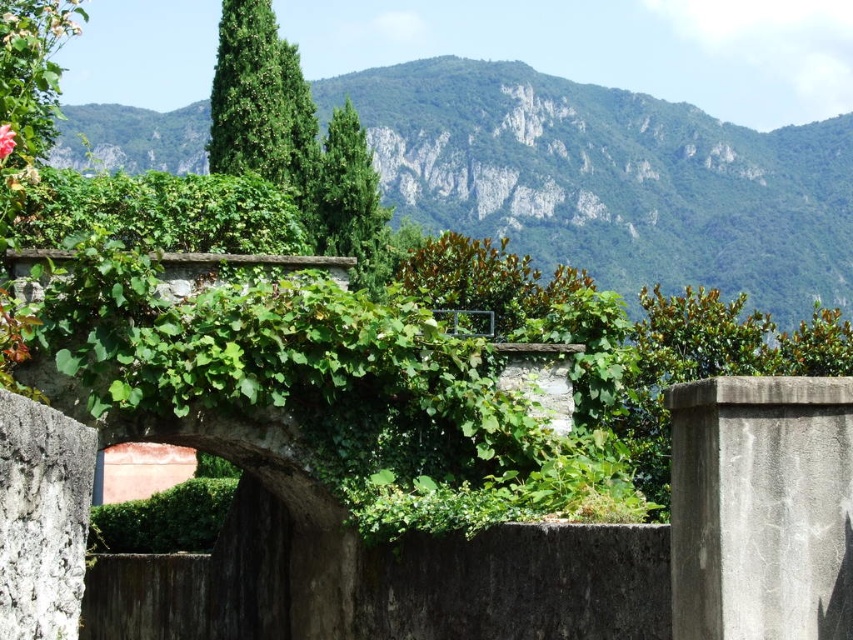
Is green leafy mountain at center to the right of green leafy plant at center from the viewer's perspective?

Yes, green leafy mountain at center is to the right of green leafy plant at center.

What do you see at coordinates (611, 179) in the screenshot?
I see `green leafy mountain at center` at bounding box center [611, 179].

Locate an element on the screen. The width and height of the screenshot is (853, 640). green leafy mountain at center is located at coordinates (611, 179).